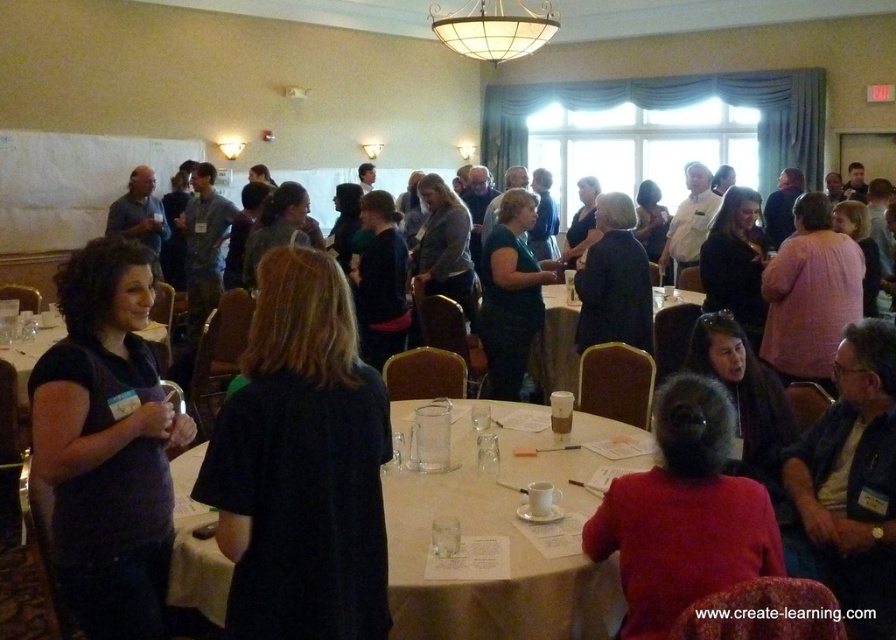
You are an attendee at this conference and you want to grab the red matte sweater at lower right from your current position. However, there is a matte black table at lower left in your way. Can you reach the sweater without moving the table?

The red matte sweater at lower right is closer to the viewer than the matte black table at lower left, so you can reach the sweater without moving the table since it is nearer to you.

You are standing at the entrance of the room and want to locate the red matte sweater at lower right. According to the coordinates provided, in which direction should you move to find it?

The red matte sweater at lower right is located at coordinates point (x=685, y=513), which is in the lower right area of the room. Since you are at the entrance, you should move towards the lower right direction to find it.

You are a photographer at the event and need to capture a photo of both the green matte shirt at center and the translucent plastic cup at center without any obstruction. Based on their sizes, which object should you focus on first to ensure it is fully visible in the frame?

The green matte shirt at center is much taller than the translucent plastic cup at center, so you should focus on capturing the green matte shirt at center first to ensure its full height is visible in the frame before adjusting for the smaller cup.